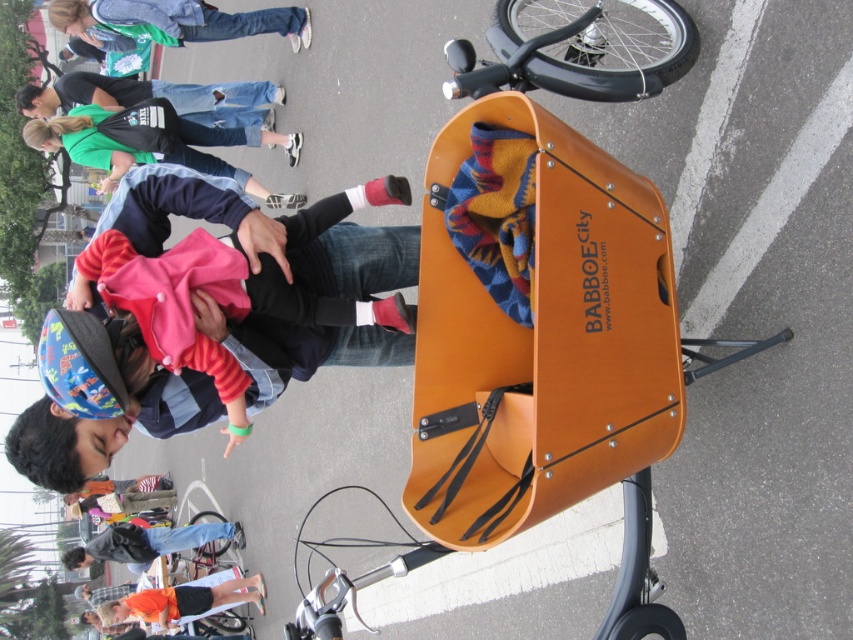
You are a photographer trying to capture a wide shot of the scene. You notice the denim jeans at upper left and the black leather jacket at lower left in your frame. Considering their widths, which one might require more space to ensure it is fully visible in the photo?

The black leather jacket at lower left has a greater width than the denim jeans at upper left, so it would require more space to ensure it is fully visible in the photo.

You are a photographer trying to capture a shot of the denim jeans at upper left and the orange fabric shirt at lower left. Which object should you focus on first if you want to ensure both are in the frame without moving the camera?

You should focus on the denim jeans at upper left first because it is shorter than the orange fabric shirt at lower left, so adjusting the frame to include the taller shirt will naturally include the shorter jeans.